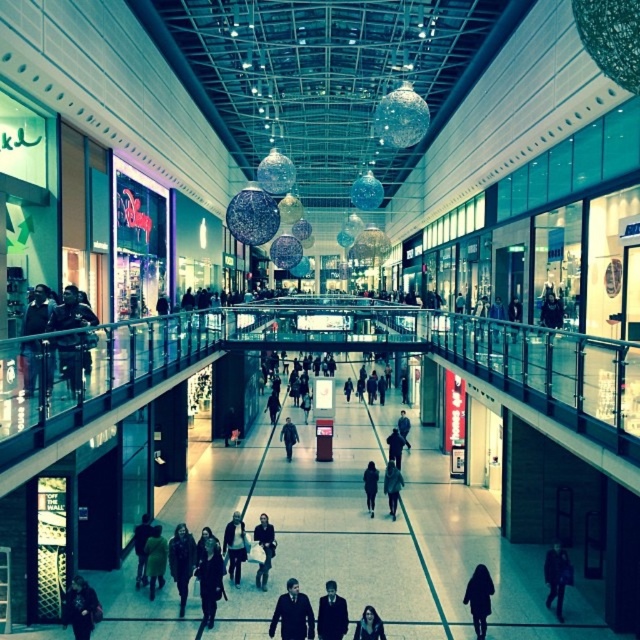
Question: Is dark brown leather coat at center further to camera compared to dark brown leather coat at lower right?

Choices:
 (A) yes
 (B) no

Answer: (A)

Question: Which object appears farthest from the camera in this image?

Choices:
 (A) dark brown leather coat at center
 (B) dark gray coat at center
 (C) dark gray fabric jacket at center
 (D) dark brown hair at center

Answer: (C)

Question: Can you confirm if dark gray coat at center is positioned to the left of dark gray jacket at center?

Choices:
 (A) yes
 (B) no

Answer: (A)

Question: Considering the real-world distances, which object is farthest from the dark brown leather coat at lower right?

Choices:
 (A) silhouette coat at center
 (B) dark gray jacket at lower left
 (C) dark brown leather jacket at center
 (D) dark brown hair at center

Answer: (B)

Question: Which point is farther from the camera taking this photo?

Choices:
 (A) (556, 605)
 (B) (481, 637)
 (C) (376, 480)
 (D) (218, 561)

Answer: (C)

Question: Is dark suit at center bigger than dark brown leather coat at lower right?

Choices:
 (A) yes
 (B) no

Answer: (A)